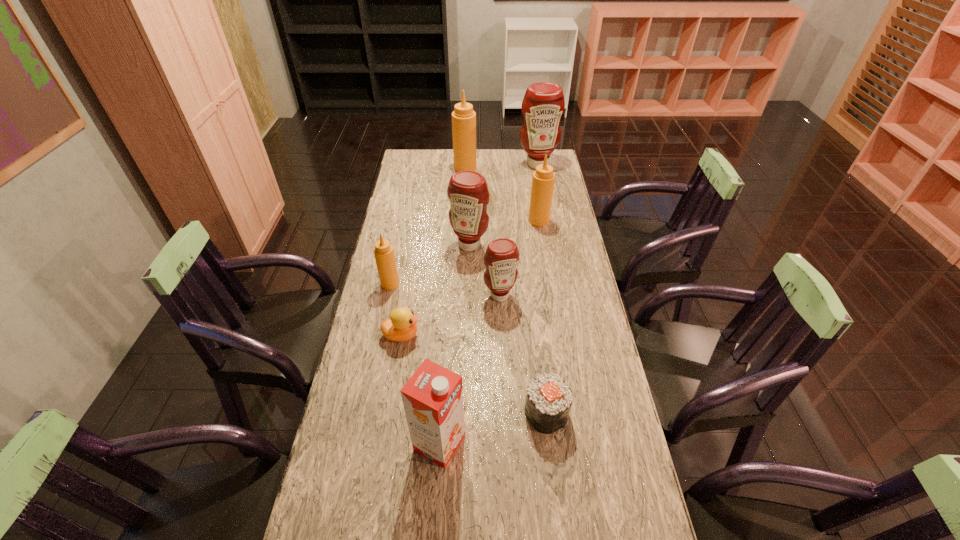
Image resolution: width=960 pixels, height=540 pixels. In order to click on the rightmost red condiment in this screenshot , I will do `click(543, 104)`.

You are a GUI agent. You are given a task and a screenshot of the screen. Output one action in this format:
    pyautogui.click(x=<x>, y=<y>)
    Task: Click on the farthest red condiment
    The width and height of the screenshot is (960, 540).
    Given the screenshot: What is the action you would take?
    pyautogui.click(x=543, y=104)

At what (x,y) coordinates should I click in order to perform the action: click on the biggest tan condiment. Please return your answer as a coordinate pair (x, y). Looking at the image, I should click on (463, 117).

Where is `the farthest tan condiment`? the farthest tan condiment is located at coordinates coord(463,117).

This screenshot has height=540, width=960. I want to click on the third farthest object, so click(543, 179).

Image resolution: width=960 pixels, height=540 pixels. In order to click on the second smallest tan condiment in this screenshot , I will do `click(543, 179)`.

At what (x,y) coordinates should I click in order to perform the action: click on the fourth farthest condiment. Please return your answer as a coordinate pair (x, y). Image resolution: width=960 pixels, height=540 pixels. Looking at the image, I should click on (467, 191).

In order to click on the second farthest red condiment in this screenshot , I will do `click(467, 191)`.

The width and height of the screenshot is (960, 540). Find the location of `carton`. carton is located at coordinates (432, 398).

Locate an element on the screen. the leftmost tan condiment is located at coordinates (384, 255).